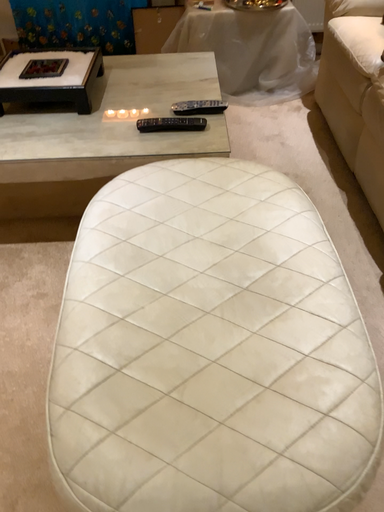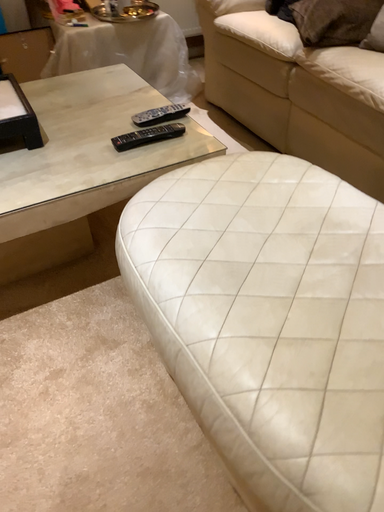
Question: How did the camera likely rotate when shooting the video?

Choices:
 (A) rotated left
 (B) rotated right

Answer: (B)